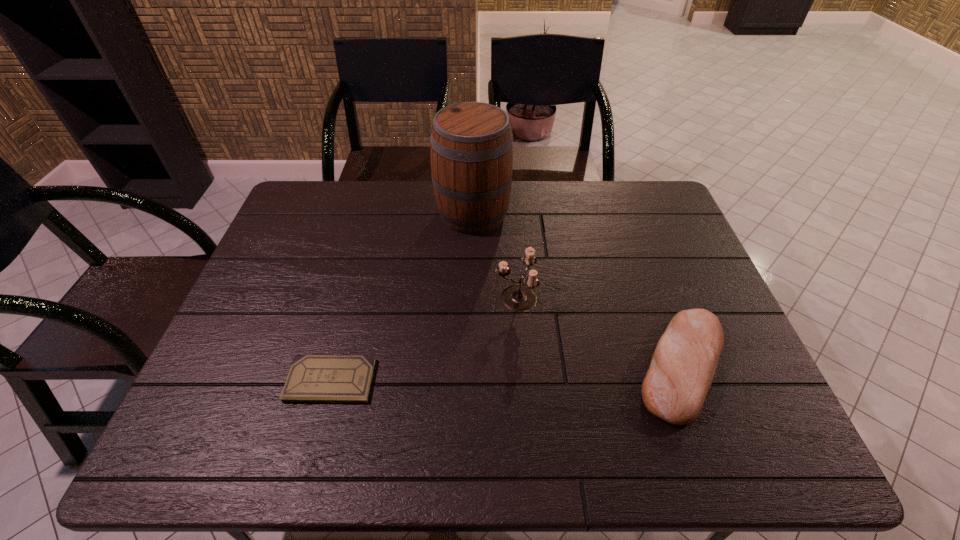
The image size is (960, 540). I want to click on vacant space at the near right corner, so 711,429.

Identify the location of free spot between the bread and the tallest object. The image size is (960, 540). (577, 290).

You are a GUI agent. You are given a task and a screenshot of the screen. Output one action in this format:
    pyautogui.click(x=<x>, y=<y>)
    Task: Click on the free space that is in between the farthest object and the candle holder
    
    Given the screenshot: What is the action you would take?
    pyautogui.click(x=494, y=256)

Locate an element on the screen. vacant region between the farthest object and the third tallest object is located at coordinates (577, 290).

The image size is (960, 540). I want to click on blank region between the rightmost object and the leftmost object, so click(x=506, y=373).

The image size is (960, 540). I want to click on free space between the checkbook and the rightmost object, so click(506, 373).

The image size is (960, 540). Identify the location of empty space between the bread and the shortest object. (506, 373).

The width and height of the screenshot is (960, 540). I want to click on vacant point located between the third nearest object and the rightmost object, so click(599, 332).

Locate an element on the screen. The width and height of the screenshot is (960, 540). blank region between the third shortest object and the rightmost object is located at coordinates (599, 332).

Image resolution: width=960 pixels, height=540 pixels. In order to click on vacant area that lies between the second farthest object and the checkbook in this screenshot , I will do click(x=423, y=339).